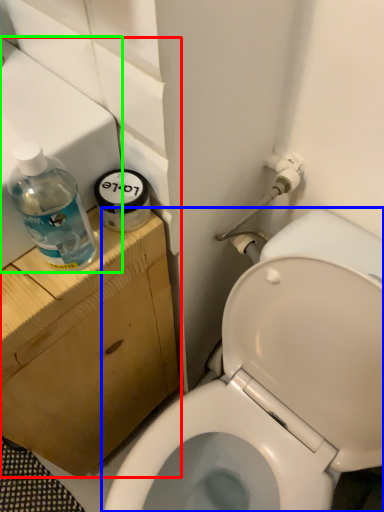
Question: Which object is positioned closest to sink (highlighted by a red box)? Select from toilet (highlighted by a blue box) and sink (highlighted by a green box).

Choices:
 (A) toilet
 (B) sink

Answer: (B)